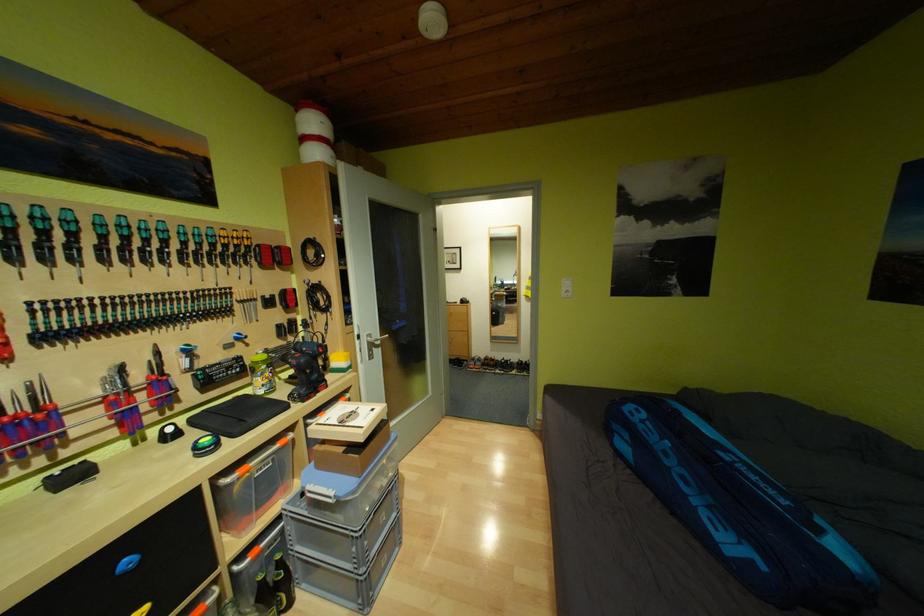
The height and width of the screenshot is (616, 924). What do you see at coordinates (611, 523) in the screenshot? I see `the sofa sitting surface` at bounding box center [611, 523].